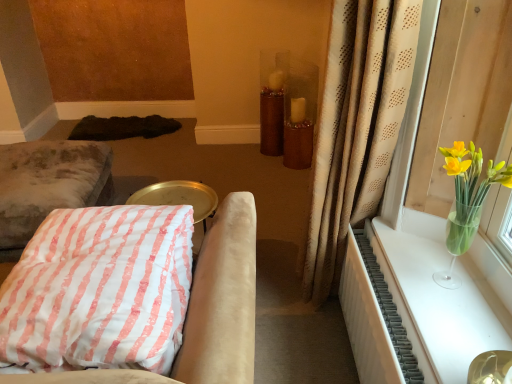
The image size is (512, 384). What are the coordinates of `vacant space behind translucent glass vase at upper right` in the screenshot? It's located at (412, 246).